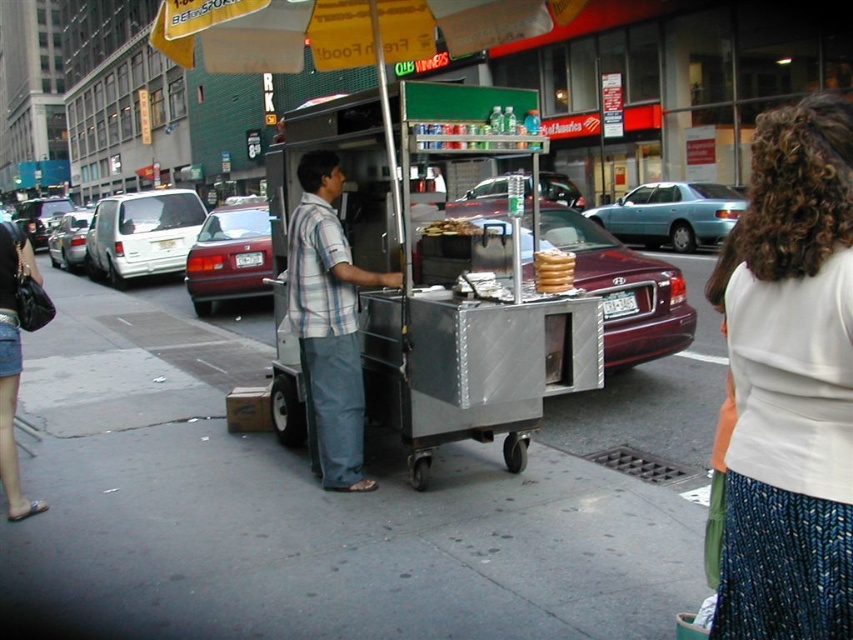
Question: Does brushed metal food cart at center have a larger size compared to white knit sweater at upper right?

Choices:
 (A) no
 (B) yes

Answer: (B)

Question: Which point is closer to the camera taking this photo?

Choices:
 (A) [x=560, y=259]
 (B) [x=790, y=605]

Answer: (B)

Question: Which object is positioned farthest from the slightly toasted bread at center?

Choices:
 (A) golden brown bread at center
 (B) white knit sweater at upper right
 (C) metallic silver cart at center
 (D) striped cotton shirt at center

Answer: (B)

Question: Which point appears farthest from the camera in this image?

Choices:
 (A) click(463, 220)
 (B) click(549, 260)

Answer: (A)

Question: Can you confirm if striped cotton shirt at center is positioned below slightly toasted bread at center?

Choices:
 (A) yes
 (B) no

Answer: (A)

Question: Can you confirm if white knit sweater at upper right is bigger than striped cotton shirt at center?

Choices:
 (A) yes
 (B) no

Answer: (B)